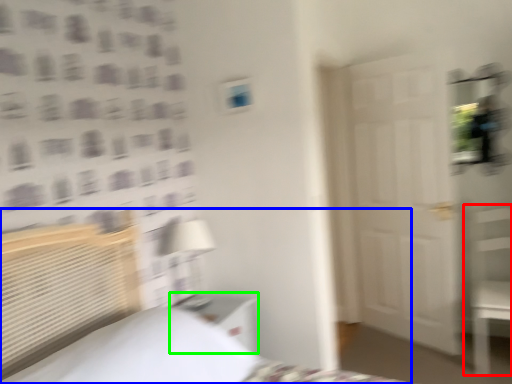
Question: Estimate the real-world distances between objects in this image. Which object is farther from furniture (highlighted by a red box), bed (highlighted by a blue box) or nightstand (highlighted by a green box)?

Choices:
 (A) bed
 (B) nightstand

Answer: (A)